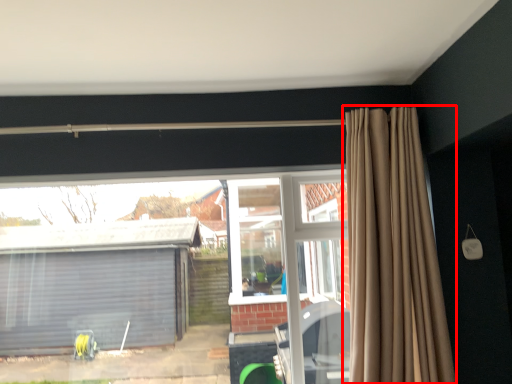
Question: From the image's perspective, considering the relative positions of curtain (annotated by the red box) and window in the image provided, where is curtain (annotated by the red box) located with respect to the staircase?

Choices:
 (A) below
 (B) above

Answer: (B)